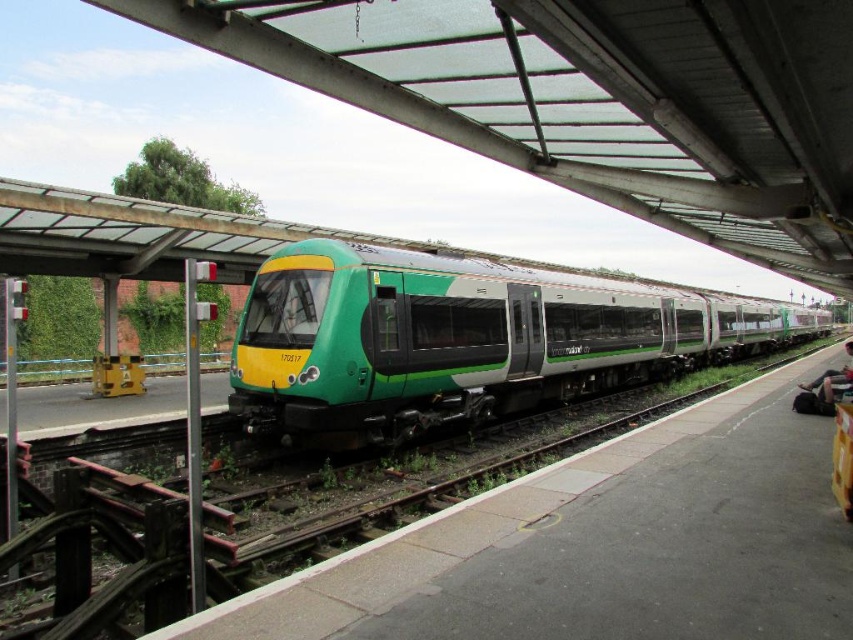
Question: Among these points, which one is farthest from the camera?

Choices:
 (A) (549, 362)
 (B) (815, 380)

Answer: (B)

Question: Is green matte train at center bigger than dark gray fabric bag at lower right?

Choices:
 (A) no
 (B) yes

Answer: (B)

Question: Does green matte train at center have a lesser width compared to dark gray fabric bag at lower right?

Choices:
 (A) no
 (B) yes

Answer: (A)

Question: Is green matte train at center bigger than dark gray fabric bag at lower right?

Choices:
 (A) yes
 (B) no

Answer: (A)

Question: Which of the following is the closest to the observer?

Choices:
 (A) dark gray fabric bag at lower right
 (B) green matte train at center

Answer: (B)

Question: Which point is farther from the camera taking this photo?

Choices:
 (A) (833, 392)
 (B) (386, 323)

Answer: (A)